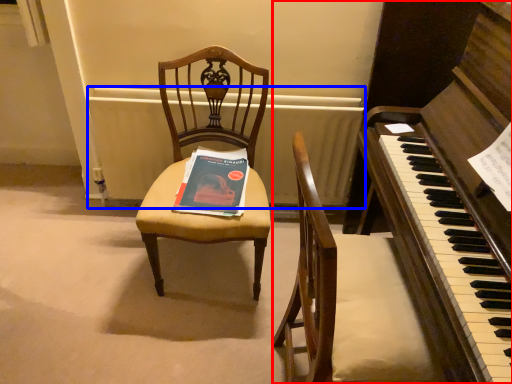
Question: Which of the following is the closest to the observer, harpsichord (highlighted by a red box) or radiator (highlighted by a blue box)?

Choices:
 (A) harpsichord
 (B) radiator

Answer: (A)